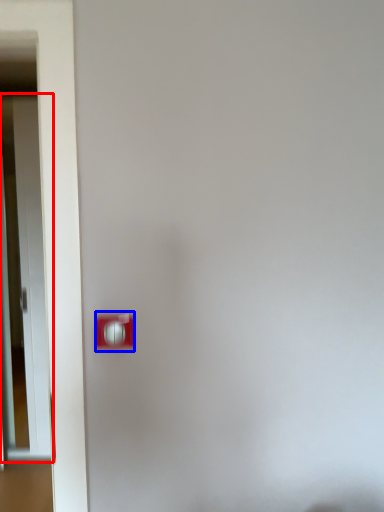
Question: Which of the following is the farthest to the observer, door (highlighted by a red box) or light switch (highlighted by a blue box)?

Choices:
 (A) door
 (B) light switch

Answer: (A)